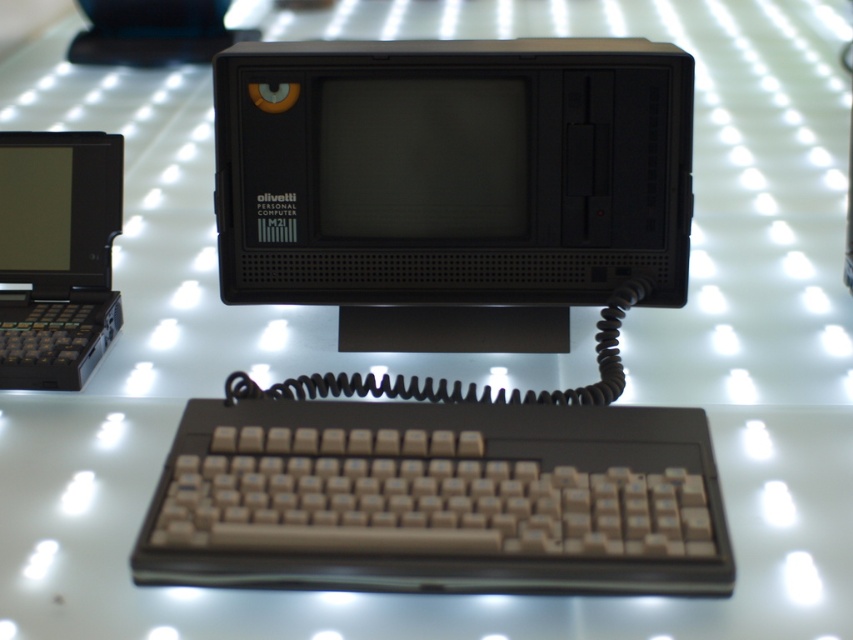
Question: Which of the following is the closest to the observer?

Choices:
 (A) (325, 86)
 (B) (310, 516)
 (C) (606, 104)
 (D) (57, 132)

Answer: (B)

Question: Can you confirm if black plastic computer at center is positioned below beige plastic keyboard at center?

Choices:
 (A) yes
 (B) no

Answer: (B)

Question: Estimate the real-world distances between objects in this image. Which object is closer to the black plastic laptop at left?

Choices:
 (A) black plastic computer monitor at center
 (B) black plastic computer at center

Answer: (B)

Question: Can you confirm if black plastic computer at center is smaller than beige plastic keyboard at center?

Choices:
 (A) no
 (B) yes

Answer: (A)

Question: Which object is positioned closest to the black plastic computer monitor at center?

Choices:
 (A) black plastic computer at center
 (B) black plastic laptop at left
 (C) beige plastic keyboard at center

Answer: (A)

Question: Considering the relative positions of black plastic computer at center and beige plastic keyboard at center in the image provided, where is black plastic computer at center located with respect to beige plastic keyboard at center?

Choices:
 (A) below
 (B) above

Answer: (B)